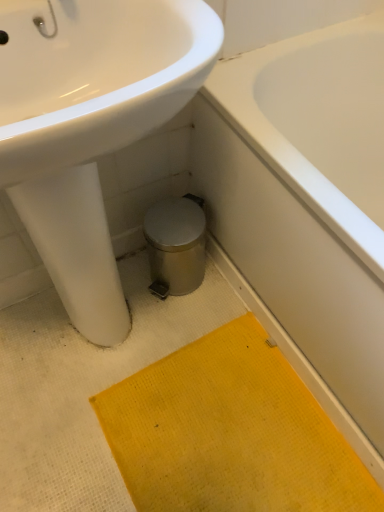
The image size is (384, 512). I want to click on space that is in front of white glossy sink at upper left, so click(124, 455).